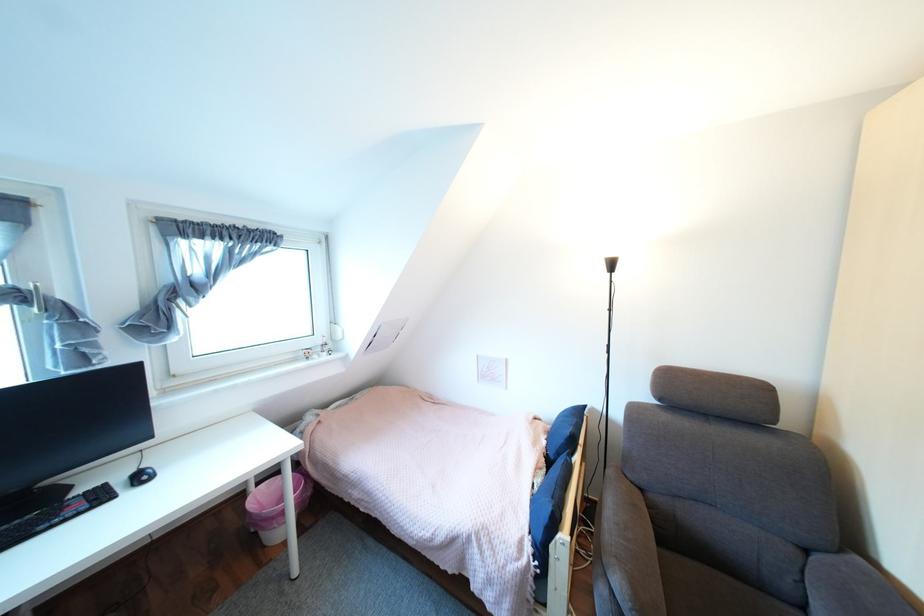
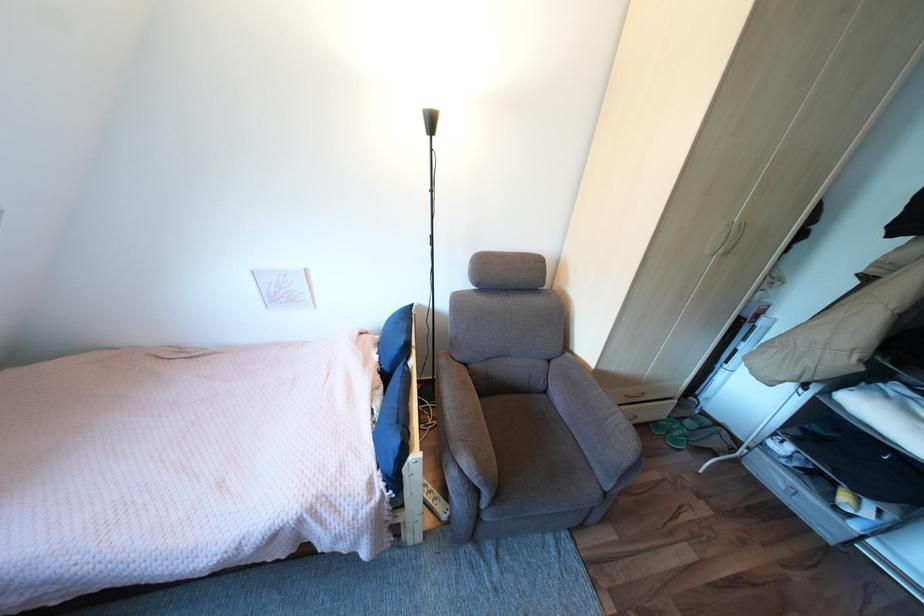
The images are taken continuously from a first-person perspective. In which direction is your viewpoint rotating?

The camera rotated toward right-down.